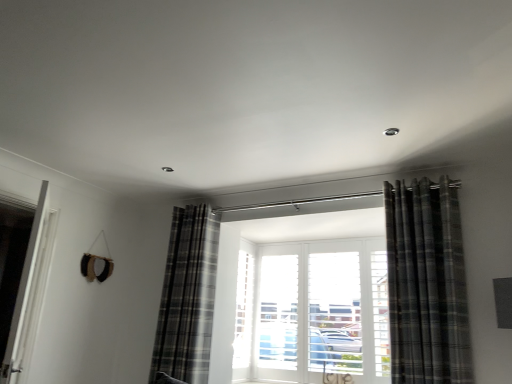
Question: Based on their positions, is plaid fabric curtain at center, positioned as the first curtain in left-to-right order, located to the left or right of plaid fabric curtain at right, placed as the first curtain when sorted from right to left?

Choices:
 (A) right
 (B) left

Answer: (B)

Question: Looking at the image, does plaid fabric curtain at center, the 2th curtain from the right, seem bigger or smaller compared to plaid fabric curtain at right, the 2th curtain in the back-to-front sequence?

Choices:
 (A) big
 (B) small

Answer: (A)

Question: Estimate the real-world distances between objects in this image. Which object is farther from the plaid fabric curtain at right, placed as the first curtain when sorted from right to left?

Choices:
 (A) white glossy door at left
 (B) plaid fabric curtain at center, the 2th curtain from the right

Answer: (A)

Question: Which is nearer to the plaid fabric curtain at center, positioned as the first curtain in left-to-right order?

Choices:
 (A) white glossy door at left
 (B) plaid fabric curtain at right, marked as the 1th curtain in a front-to-back arrangement

Answer: (A)